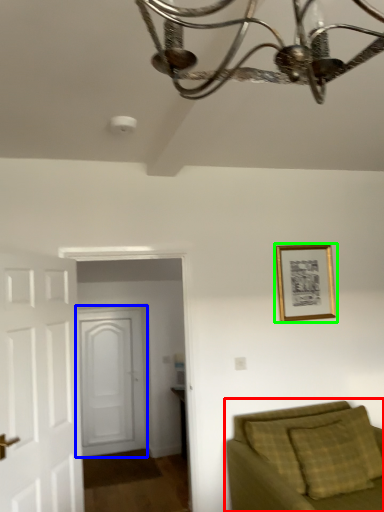
Question: Which object is the farthest from studio couch (highlighted by a red box)? Choose among these: door (highlighted by a blue box) or picture frame (highlighted by a green box).

Choices:
 (A) door
 (B) picture frame

Answer: (A)